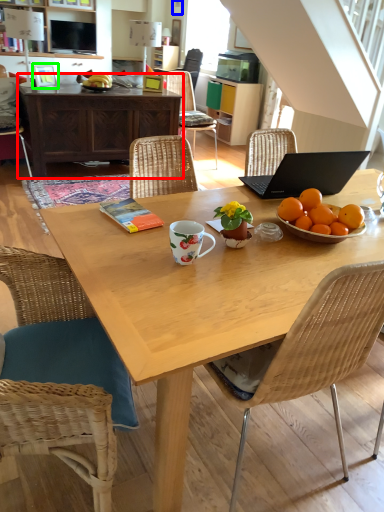
Question: Which is nearer to the desk (highlighted by a red box)? picture frame (highlighted by a blue box) or picture frame (highlighted by a green box).

Choices:
 (A) picture frame
 (B) picture frame

Answer: (B)